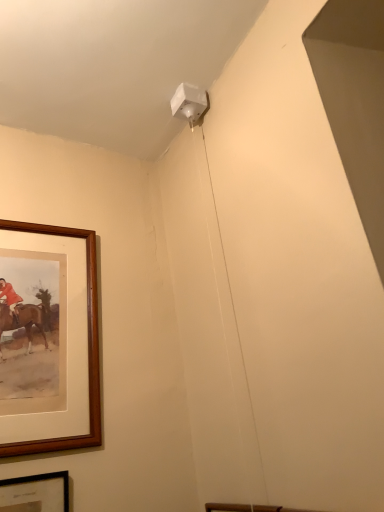
Question: Relative to wooden picture frame at lower left, acting as the 1th picture frame starting from the bottom, is brown wooden picture frame at left, the first picture frame when ordered from top to bottom, in front or behind?

Choices:
 (A) behind
 (B) front

Answer: (A)

Question: From the image's perspective, relative to wooden picture frame at lower left, acting as the 1th picture frame starting from the bottom, is brown wooden picture frame at left, the first picture frame when ordered from top to bottom, above or below?

Choices:
 (A) above
 (B) below

Answer: (A)

Question: Based on their positions, is brown wooden picture frame at left, marked as the second picture frame in a bottom-to-top arrangement, located to the left or right of wooden picture frame at lower left, marked as the second picture frame in a top-to-bottom arrangement?

Choices:
 (A) right
 (B) left

Answer: (A)

Question: Based on their positions, is wooden picture frame at lower left, marked as the second picture frame in a top-to-bottom arrangement, located to the left or right of brown wooden picture frame at left, the first picture frame when ordered from top to bottom?

Choices:
 (A) right
 (B) left

Answer: (B)

Question: From the image's perspective, is wooden picture frame at lower left, marked as the second picture frame in a top-to-bottom arrangement, positioned above or below brown wooden picture frame at left, marked as the second picture frame in a bottom-to-top arrangement?

Choices:
 (A) below
 (B) above

Answer: (A)

Question: Considering the positions of point (14, 494) and point (76, 438), is point (14, 494) closer or farther from the camera than point (76, 438)?

Choices:
 (A) closer
 (B) farther

Answer: (A)

Question: Is wooden picture frame at lower left, marked as the second picture frame in a top-to-bottom arrangement, taller or shorter than brown wooden picture frame at left, the first picture frame when ordered from top to bottom?

Choices:
 (A) short
 (B) tall

Answer: (A)